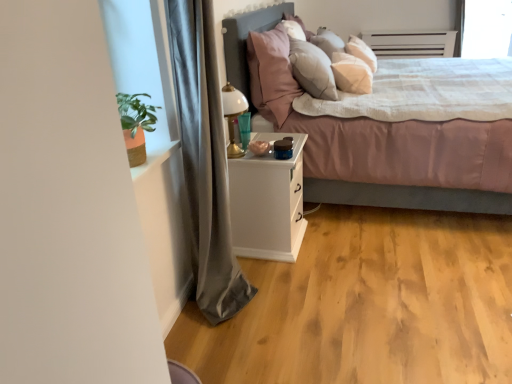
What is the approximate width of gray fabric curtain at left?

11.06 inches.

Identify the location of white matte nightstand at center. The height and width of the screenshot is (384, 512). click(267, 202).

From the image's perspective, who appears lower, gray fabric curtain at left or gold metallic table lamp at center?

From the image's view, gray fabric curtain at left is below.

Is gold metallic table lamp at center completely or partially inside gray fabric curtain at left?

Definitely not — gold metallic table lamp at center is not inside gray fabric curtain at left.

Is gray fabric curtain at left in contact with gold metallic table lamp at center?

No, gray fabric curtain at left is not with gold metallic table lamp at center.

Does gray fabric curtain at left come behind gold metallic table lamp at center?

No, gray fabric curtain at left is closer to the viewer.

Can you see gold metallic table lamp at center touching pink plush pillow at upper center?

gold metallic table lamp at center and pink plush pillow at upper center are not in contact.

What's the angular difference between gold metallic table lamp at center and pink plush pillow at upper center's facing directions?

The angular difference between gold metallic table lamp at center and pink plush pillow at upper center is 1.64 degrees.

Where is `table lamp lying on the left of pink plush pillow at upper center`? Image resolution: width=512 pixels, height=384 pixels. table lamp lying on the left of pink plush pillow at upper center is located at coordinates click(x=233, y=116).

Which of these two, matte pink fabric bed at center or transparent glass window screen at upper right, is wider?

matte pink fabric bed at center is wider.

Does point (446, 15) come behind point (495, 55)?

That is False.

Does matte pink fabric bed at center touch transparent glass window screen at upper right?

No, matte pink fabric bed at center is not touching transparent glass window screen at upper right.

Is point (218, 126) closer to camera compared to point (508, 31)?

Yes, it is in front of point (508, 31).

Locate an element on the screen. The image size is (512, 384). window screen behind the gray fabric curtain at left is located at coordinates (x=486, y=28).

Is transparent glass window screen at upper right inside gray fabric curtain at left?

That's incorrect, transparent glass window screen at upper right is not inside gray fabric curtain at left.

Can you confirm if gray fabric curtain at left is smaller than transparent glass window screen at upper right?

Actually, gray fabric curtain at left might be larger than transparent glass window screen at upper right.

Is pink plush pillow at upper center positioned beyond the bounds of transparent glass window screen at upper right?

Indeed, pink plush pillow at upper center is completely outside transparent glass window screen at upper right.

Considering the positions of point (279, 78) and point (502, 16), is point (279, 78) closer or farther from the camera than point (502, 16)?

Point (279, 78) is positioned closer to the camera compared to point (502, 16).

Between pink plush pillow at upper center and transparent glass window screen at upper right, which one appears on the left side from the viewer's perspective?

From the viewer's perspective, pink plush pillow at upper center appears more on the left side.

Considering the sizes of pink plush pillow at upper center and transparent glass window screen at upper right in the image, is pink plush pillow at upper center taller or shorter than transparent glass window screen at upper right?

Considering their sizes, pink plush pillow at upper center has less height than transparent glass window screen at upper right.

Is white matte nightstand at center bigger than pink plush pillow at upper center?

Actually, white matte nightstand at center might be smaller than pink plush pillow at upper center.

Would you consider white matte nightstand at center to be distant from pink plush pillow at upper center?

white matte nightstand at center is near pink plush pillow at upper center, not far away.

Considering their positions, is white matte nightstand at center located in front of or behind pink plush pillow at upper center?

white matte nightstand at center is in front of pink plush pillow at upper center.

From the image's perspective, which one is positioned lower, white matte nightstand at center or pink plush pillow at upper center?

white matte nightstand at center.

Which point is more forward, (210, 225) or (258, 99)?

Point (210, 225)

Considering the sizes of objects gray fabric curtain at left and pink plush pillow at upper center in the image provided, who is taller, gray fabric curtain at left or pink plush pillow at upper center?

gray fabric curtain at left.

Is gray fabric curtain at left to the right of pink plush pillow at upper center from the viewer's perspective?

In fact, gray fabric curtain at left is to the left of pink plush pillow at upper center.

The image size is (512, 384). In order to click on pillow located above the gray fabric curtain at left (from a real-world perspective) in this screenshot , I will do `click(271, 74)`.

I want to click on curtain that appears below the gold metallic table lamp at center (from a real-world perspective), so click(x=204, y=159).

Locate an element on the screen. table lamp lying below the pink plush pillow at upper center (from the image's perspective) is located at coordinates (233, 116).

When comparing their distances from white matte nightstand at center, does gold metallic table lamp at center or matte pink fabric bed at center seem closer?

Based on the image, gold metallic table lamp at center appears to be nearer to white matte nightstand at center.

Which object lies nearer to the anchor point gold metallic table lamp at center, gray fabric curtain at left or matte pink fabric bed at center?

The object closer to gold metallic table lamp at center is gray fabric curtain at left.

Estimate the real-world distances between objects in this image. Which object is further from gray fabric curtain at left, transparent glass window screen at upper right or white matte nightstand at center?

The object further to gray fabric curtain at left is transparent glass window screen at upper right.

Which object lies nearer to the anchor point white matte nightstand at center, matte pink fabric bed at center or gray fabric curtain at left?

The object closer to white matte nightstand at center is gray fabric curtain at left.

From the image, which object appears to be nearer to transparent glass window screen at upper right, gold metallic table lamp at center or matte pink fabric bed at center?

matte pink fabric bed at center lies closer to transparent glass window screen at upper right than the other object.

Considering their positions, is gray fabric curtain at left positioned closer to pink plush pillow at upper center than gold metallic table lamp at center?

The object closer to pink plush pillow at upper center is gold metallic table lamp at center.

Considering their positions, is white matte nightstand at center positioned further to gray fabric curtain at left than pink plush pillow at upper center?

pink plush pillow at upper center is further to gray fabric curtain at left.

Considering their positions, is transparent glass window screen at upper right positioned closer to pink plush pillow at upper center than gold metallic table lamp at center?

gold metallic table lamp at center is positioned closer to the anchor pink plush pillow at upper center.

At what (x,y) coordinates should I click in order to perform the action: click on table lamp between matte pink fabric bed at center and transparent glass window screen at upper right from front to back. Please return your answer as a coordinate pair (x, y). Image resolution: width=512 pixels, height=384 pixels. Looking at the image, I should click on (233, 116).

Find the location of a particular element. Image resolution: width=512 pixels, height=384 pixels. bed located between gray fabric curtain at left and transparent glass window screen at upper right in the depth direction is located at coordinates (407, 196).

The width and height of the screenshot is (512, 384). In order to click on pillow positioned between white matte nightstand at center and transparent glass window screen at upper right from near to far in this screenshot , I will do `click(271, 74)`.

Image resolution: width=512 pixels, height=384 pixels. Identify the location of table lamp between pink plush pillow at upper center and white matte nightstand at center from top to bottom. (233, 116).